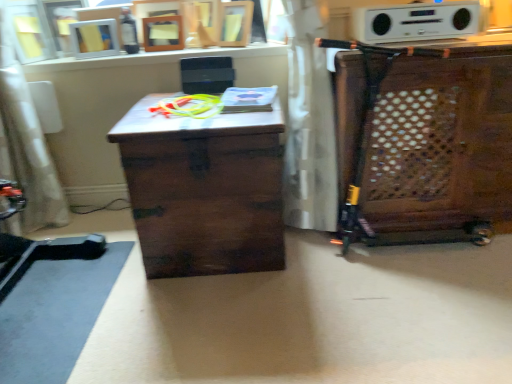
Identify the location of vacant region below white fabric swivel chair at left (from a real-world perspective). Image resolution: width=512 pixels, height=384 pixels. (x=47, y=226).